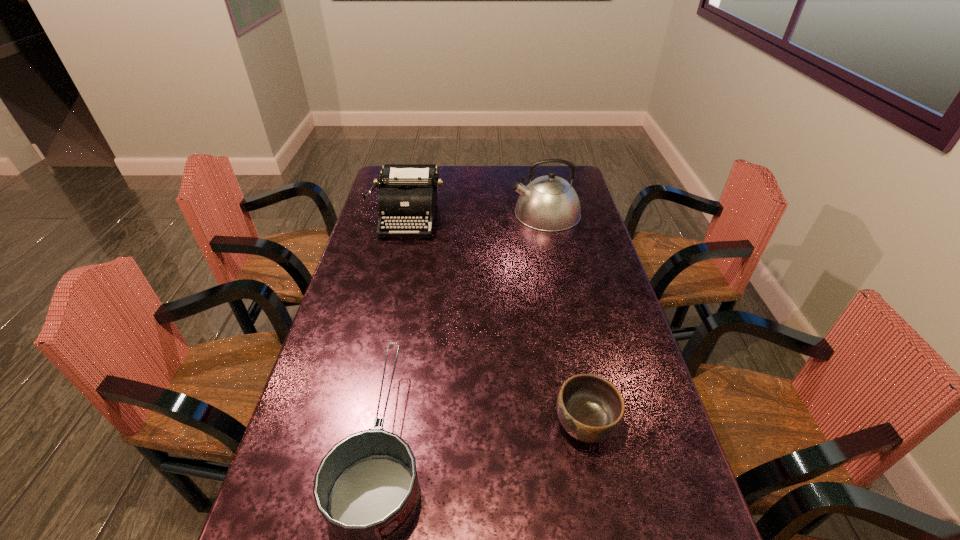
Locate an element on the screen. object that ranks as the third closest to the second tallest object is located at coordinates (590, 408).

Locate an element on the screen. blank area in the image that satisfies the following two spatial constraints: 1. from the spout of the tallest object; 2. on the typing side of the third shortest object is located at coordinates (547, 217).

Locate an element on the screen. This screenshot has width=960, height=540. vacant space that satisfies the following two spatial constraints: 1. from the spout of the tallest object; 2. on the front side of the bowl is located at coordinates (589, 424).

The image size is (960, 540). Identify the location of free space that satisfies the following two spatial constraints: 1. on the typing side of the bowl; 2. on the right side of the second tallest object. (361, 424).

Locate an element on the screen. This screenshot has width=960, height=540. free space that satisfies the following two spatial constraints: 1. on the typing side of the bowl; 2. on the right side of the second tallest object is located at coordinates (361, 424).

The width and height of the screenshot is (960, 540). I want to click on vacant space that satisfies the following two spatial constraints: 1. from the spout of the kettle; 2. on the typing side of the typewriter, so click(547, 217).

What are the coordinates of `free space that satisfies the following two spatial constraints: 1. on the typing side of the bowl; 2. on the right side of the typewriter` in the screenshot? It's located at (361, 424).